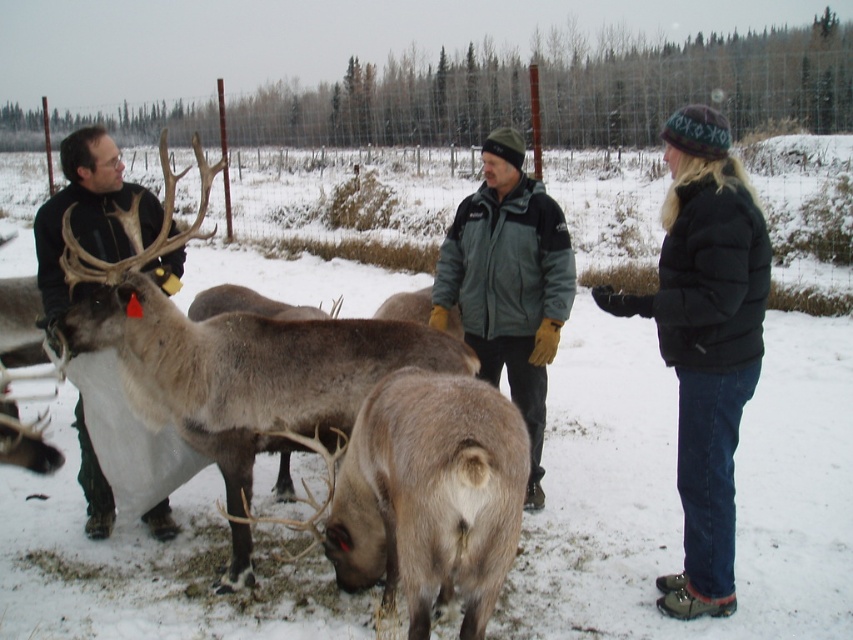
Question: Is gray fleece jacket at center to the right of matte black jacket at left from the viewer's perspective?

Choices:
 (A) no
 (B) yes

Answer: (B)

Question: Which point appears farthest from the camera in this image?

Choices:
 (A) (164, 502)
 (B) (611, 298)

Answer: (A)

Question: Which of the following is the closest to the observer?

Choices:
 (A) (766, 252)
 (B) (53, 269)

Answer: (A)

Question: Considering the real-world distances, which object is farthest from the gray fleece jacket at center?

Choices:
 (A) black puffy jacket at right
 (B) brown fur reindeer at center
 (C) matte black jacket at left

Answer: (C)

Question: Is brown fur reindeer at center smaller than gray fleece jacket at center?

Choices:
 (A) no
 (B) yes

Answer: (A)

Question: Where is brown fur reindeer at center located in relation to black puffy jacket at right in the image?

Choices:
 (A) left
 (B) right

Answer: (A)